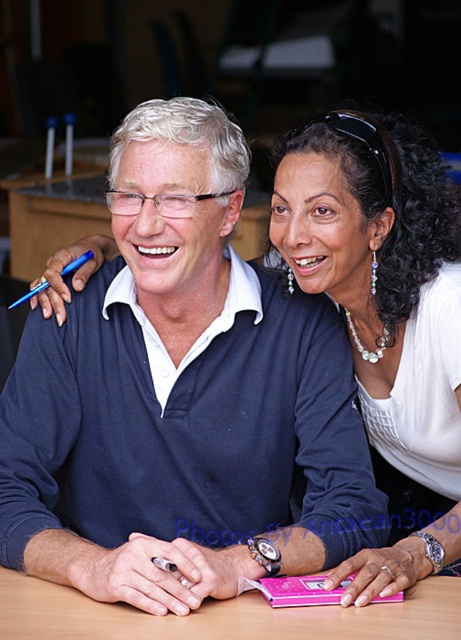
Which is below, matte blue sweater at center or pearl necklace at center?

matte blue sweater at center

Is matte blue sweater at center in front of pearl necklace at center?

Yes, it is in front of pearl necklace at center.

Locate an element on the screen. matte blue sweater at center is located at coordinates (181, 396).

What are the coordinates of `matte blue sweater at center` in the screenshot? It's located at (x=181, y=396).

Who is positioned more to the right, matte blue sweater at center or wooden table at center?

Positioned to the right is wooden table at center.

Does matte blue sweater at center come in front of wooden table at center?

No, it is behind wooden table at center.

What do you see at coordinates (181, 396) in the screenshot?
I see `matte blue sweater at center` at bounding box center [181, 396].

This screenshot has width=461, height=640. Find the location of `matte blue sweater at center`. matte blue sweater at center is located at coordinates (181, 396).

Can you confirm if pearl necklace at center is positioned to the right of wooden table at center?

Yes, pearl necklace at center is to the right of wooden table at center.

Image resolution: width=461 pixels, height=640 pixels. In order to click on pearl necklace at center in this screenshot , I will do point(385,317).